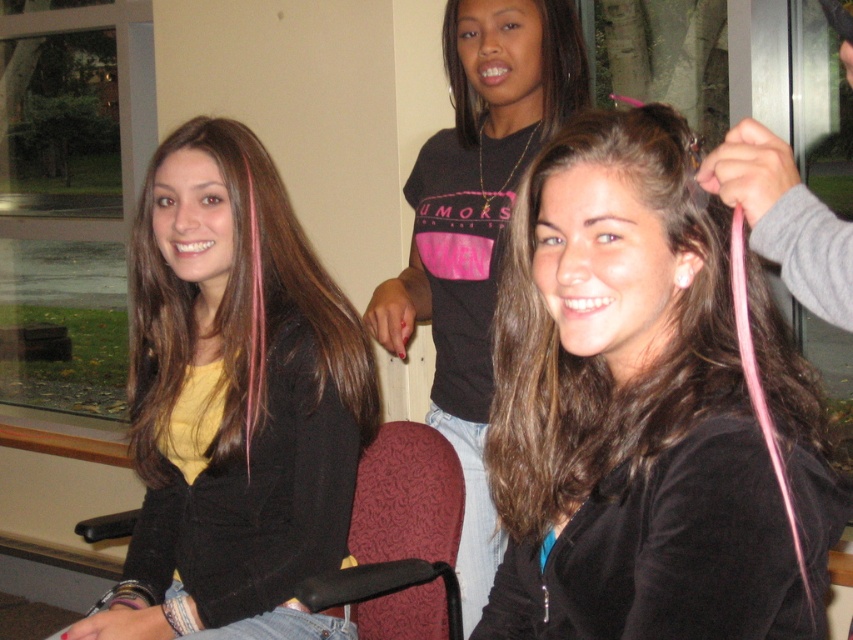
Question: Estimate the real-world distances between objects in this image. Which object is farther from the black shiny hair at upper center?

Choices:
 (A) brownsmoothhair at left
 (B) matte black shirt at upper center

Answer: (A)

Question: Which object is positioned farthest from the brownsmoothhair at left?

Choices:
 (A) black shiny hair at upper center
 (B) matte black shirt at upper center

Answer: (A)

Question: Can you confirm if matte black shirt at upper center is positioned below maroon fabric chair at lower center?

Choices:
 (A) no
 (B) yes

Answer: (A)

Question: Considering the real-world distances, which object is farthest from the brownsmoothhair at left?

Choices:
 (A) black shiny hair at upper center
 (B) pink silky hair at center
 (C) matte black shirt at upper center
 (D) maroon fabric chair at lower center

Answer: (B)

Question: Does matte black shirt at upper center come in front of black shiny hair at upper center?

Choices:
 (A) yes
 (B) no

Answer: (A)

Question: Does matte black shirt at upper center have a smaller size compared to brownsmoothhair at left?

Choices:
 (A) yes
 (B) no

Answer: (B)